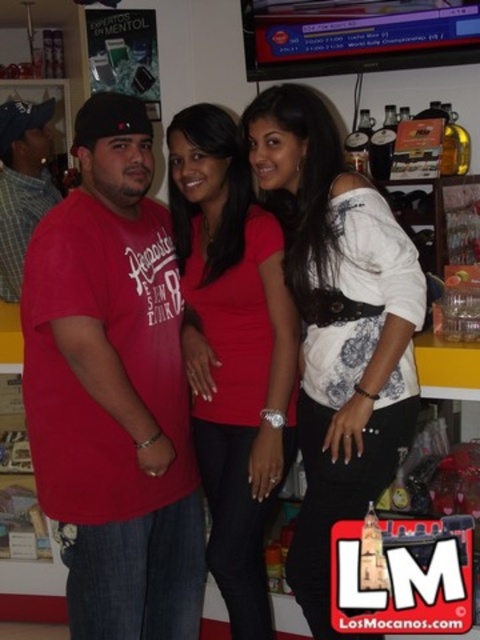
You are trying to locate the white matte shirt at center in a photo. According to the coordinates provided, where exactly is it positioned?

The white matte shirt at center is positioned at coordinates point (337, 324).

You are a photographer trying to capture a group photo of the white matte shirt at center and the other two people. If the minimum distance required between subjects for clear focus is 5 feet, will you need to adjust their positions?

The subjects are 4.85 feet apart, which is less than the required 5 feet for clear focus. You should ask them to move slightly farther apart to ensure proper focus.